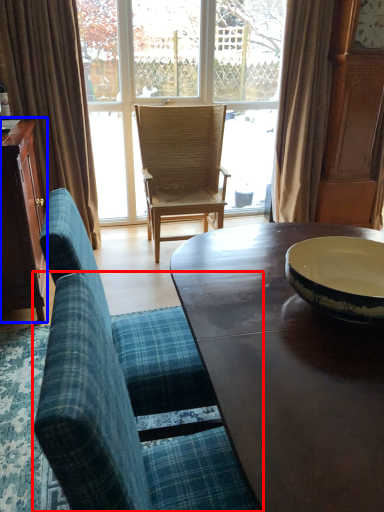
Question: Which of the following is the farthest to the observer, chair (highlighted by a red box) or cabinetry (highlighted by a blue box)?

Choices:
 (A) chair
 (B) cabinetry

Answer: (B)